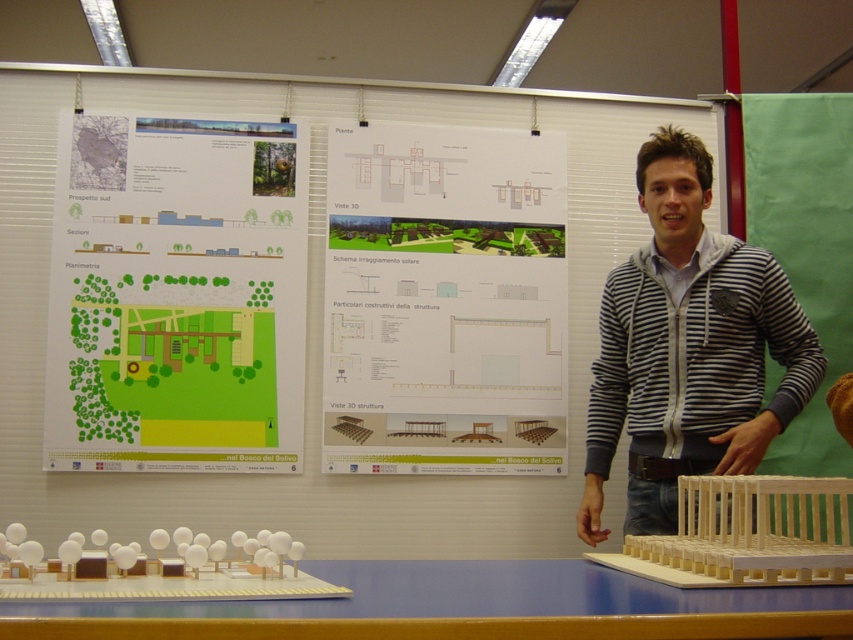
Does green paper at upper left have a smaller size compared to blue wood table at lower center?

Indeed, green paper at upper left has a smaller size compared to blue wood table at lower center.

Does point (231, 362) come behind point (711, 605)?

Yes, it is.

You are a GUI agent. You are given a task and a screenshot of the screen. Output one action in this format:
    pyautogui.click(x=<x>, y=<y>)
    Task: Click on the green paper at upper left
    
    Given the screenshot: What is the action you would take?
    pyautogui.click(x=177, y=296)

Does striped hoodie at center have a lesser width compared to blue wood table at lower center?

Yes.

Can you confirm if striped hoodie at center is shorter than blue wood table at lower center?

No.

Is point (699, 419) farther from viewer compared to point (386, 596)?

Yes.

The height and width of the screenshot is (640, 853). What are the coordinates of `striped hoodie at center` in the screenshot? It's located at (688, 348).

Between point (412, 193) and point (683, 419), which one is positioned behind?

Positioned behind is point (412, 193).

Image resolution: width=853 pixels, height=640 pixels. Identify the location of white paper at center. (444, 301).

The height and width of the screenshot is (640, 853). Identify the location of white paper at center. 444,301.